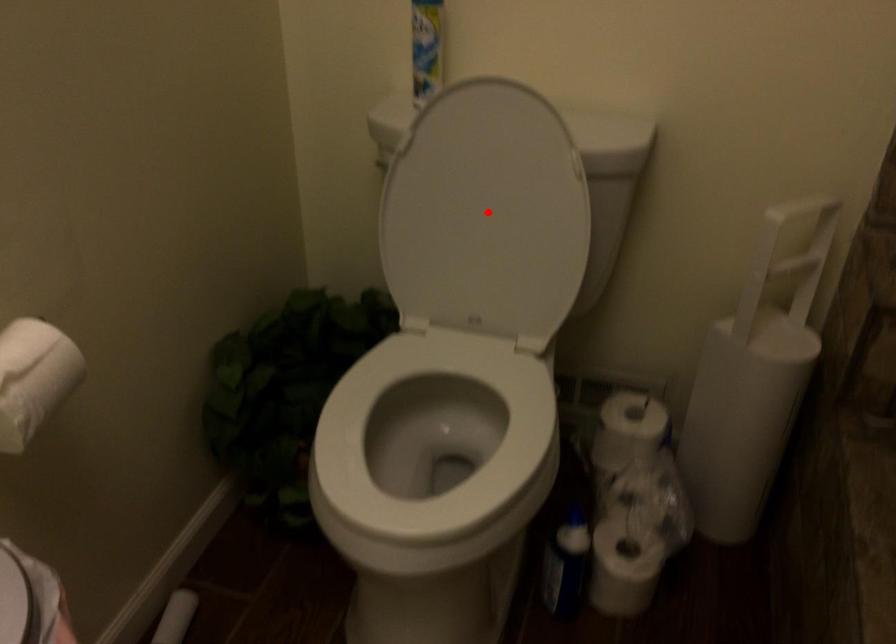
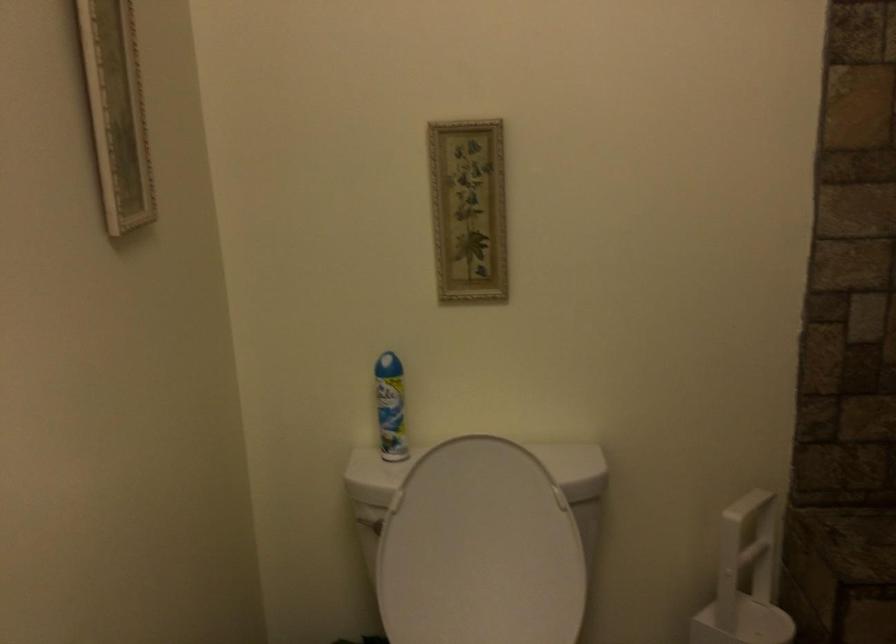
Find the pixel in the second image that matches the highlighted location in the first image.

(479, 550)